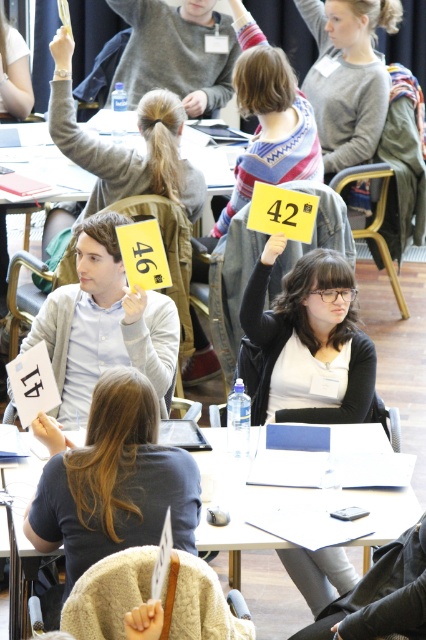
You are a facilitator in a meeting and need to retrieve the matte black card at center and the matte white card at center from the table. Which card should you pick up first to avoid covering the other?

You should pick up the matte white card at center first since the matte black card at center is positioned under it. This way, you won

You are a facilitator in the room and need to determine which object is smaller between the matte black card at center and the matte gray sweater at upper center. Based on the scene, which one is smaller?

The matte black card at center is smaller than the matte gray sweater at upper center.